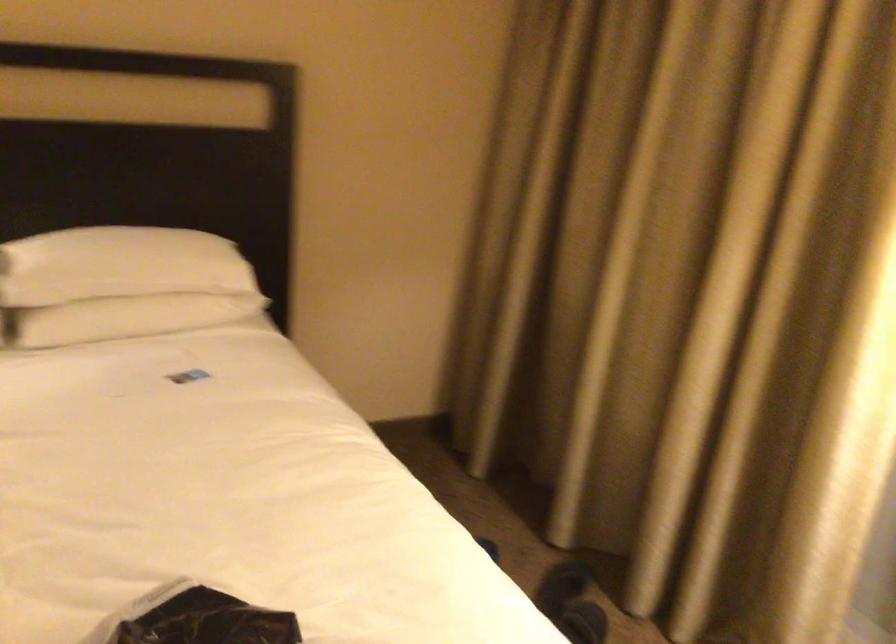
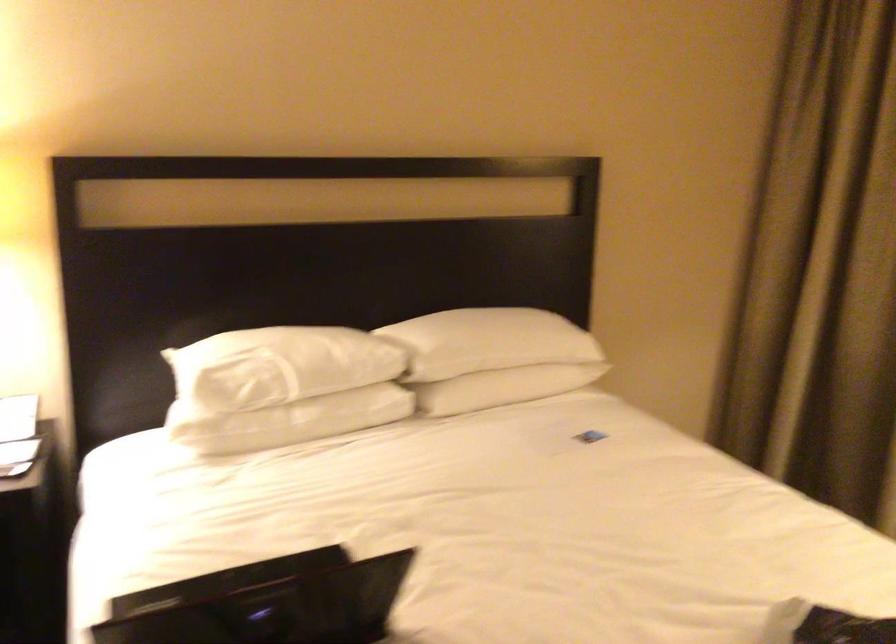
Which direction would the cameraman need to move to produce the second image?

The cameraman walked toward left, backward.